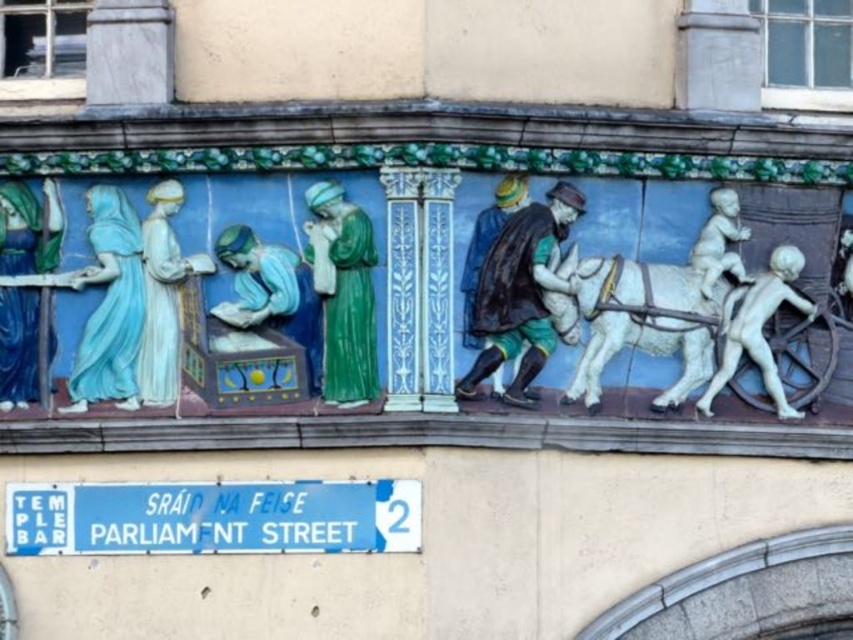
You are an art student analyzing the decorative frieze. You notice the green glazed ceramic figure at center and the white marble children at right. Which of these two figures is located more to the left side of the frieze?

The green glazed ceramic figure at center is positioned on the left side of white marble children at right, so it is more to the left side of the frieze.

You are an art conservator examining the decorative frieze. You notice two central figures, the white glossy horse at center and the smooth white baby at center. Which of these figures is positioned closer to the viewer?

The white glossy horse at center is positioned closer to the viewer because it is in front of the smooth white baby at center.

You are an art student analyzing the decorative frieze. You notice the blue plastic sign at lower center and the matte blue dress at upper left. Which object is located to the right of the other?

The blue plastic sign at lower center is positioned on the right side of matte blue dress at upper left, so the blue plastic sign at lower center is to the right of the matte blue dress at upper left.